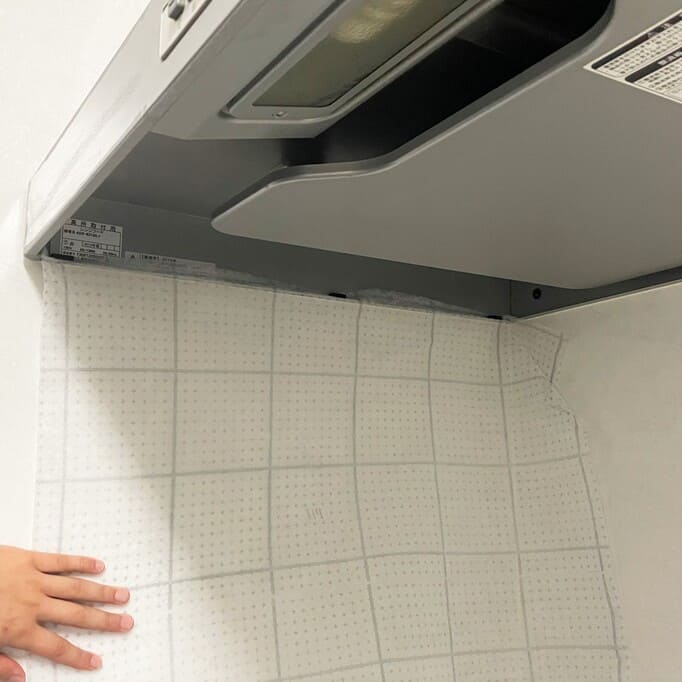
Find the location of a particular element. light bezel mounting screw is located at coordinates (280, 116).